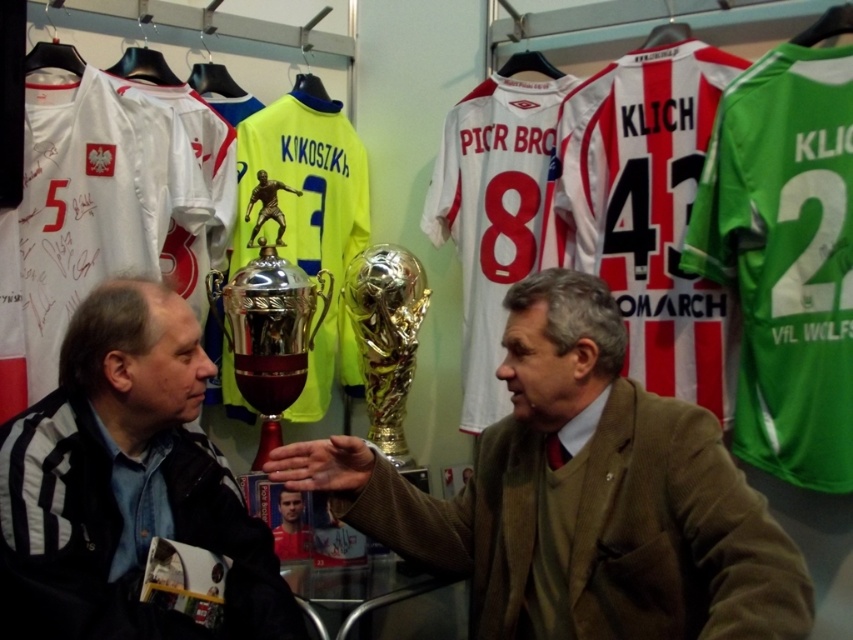
You are a delivery person who needs to place a package between the black leather jacket at center and the gold metallic trophy at center. The package is 25 inches long. Will it fit between them?

The black leather jacket at center and gold metallic trophy at center are 30.43 inches apart from each other. Since the package is 25 inches long, it will fit between them as there is enough space.

You are standing in the sports memorabilia display area. There is a point at coordinates point (120, 323). Can you reach this point with your hand if you extend it fully?

The point (120, 323) is 1.40 meters from viewer, so yes, you can reach it with your fully extended hand since the average arm length is about 0.7 meters.